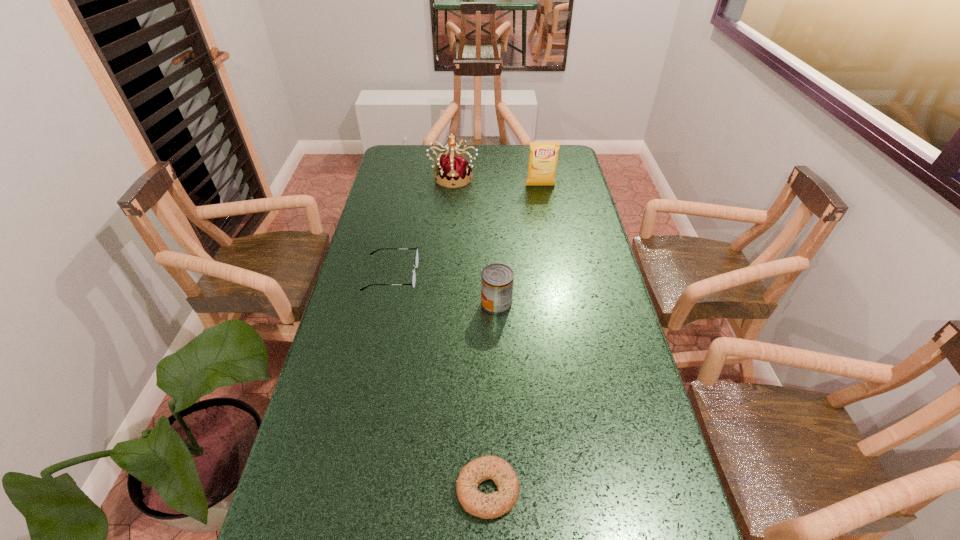
You are a GUI agent. You are given a task and a screenshot of the screen. Output one action in this format:
    pyautogui.click(x=<x>, y=<y>)
    Task: Click on the tiara
    This screenshot has height=540, width=960.
    Given the screenshot: What is the action you would take?
    pyautogui.click(x=454, y=169)

Identify the location of the rightmost object. The height and width of the screenshot is (540, 960). (543, 157).

At what (x,y) coordinates should I click in order to perform the action: click on can. Please return your answer as a coordinate pair (x, y). The width and height of the screenshot is (960, 540). Looking at the image, I should click on (497, 280).

This screenshot has width=960, height=540. I want to click on spectacles, so click(416, 256).

The width and height of the screenshot is (960, 540). In order to click on the shortest object in this screenshot , I will do `click(493, 505)`.

This screenshot has width=960, height=540. Find the location of `the nearest object`. the nearest object is located at coordinates (493, 505).

Identify the location of free spot located on the front-facing side of the tiara. This screenshot has width=960, height=540. (447, 252).

Where is `vacant space located 0.210m on the front of the rightmost object with the logo`? The height and width of the screenshot is (540, 960). vacant space located 0.210m on the front of the rightmost object with the logo is located at coordinates (546, 219).

The image size is (960, 540). What are the coordinates of `vacant position located on the front of the third tallest object` in the screenshot? It's located at (501, 423).

In order to click on free space located on the lenses of the second shortest object in this screenshot , I will do `click(433, 275)`.